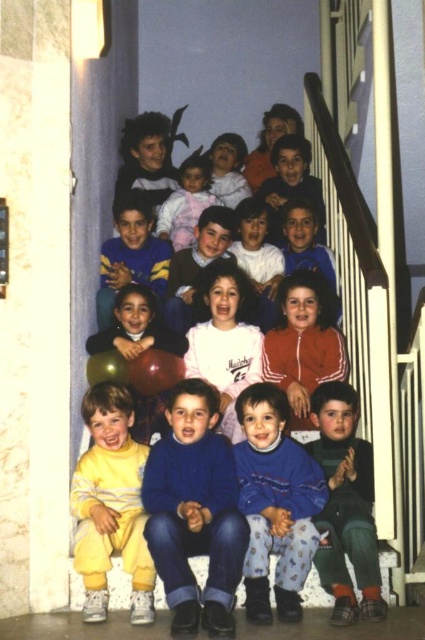
Question: Is blue sweater at center below matte red jacket at center?

Choices:
 (A) yes
 (B) no

Answer: (A)

Question: Which object is positioned farthest from the yellow fleece pants at lower left?

Choices:
 (A) light pink fleece at center
 (B) blue sweater at center
 (C) blue fleece pants at lower center
 (D) white cotton shirt at center

Answer: (A)

Question: Based on their relative distances, which object is farther from the matte red jacket at center?

Choices:
 (A) blue fleece pants at lower center
 (B) blue sweater at center
 (C) dark green sweater at lower right

Answer: (B)

Question: Is yellow fleece at center wider than light pink fleece at center?

Choices:
 (A) no
 (B) yes

Answer: (B)

Question: Among these points, which one is farthest from the camera?

Choices:
 (A) (357, 348)
 (B) (176, 200)
 (C) (84, 515)
 (D) (210, 346)

Answer: (B)

Question: Is blue sweater at center positioned behind yellow fleece pants at lower left?

Choices:
 (A) yes
 (B) no

Answer: (B)